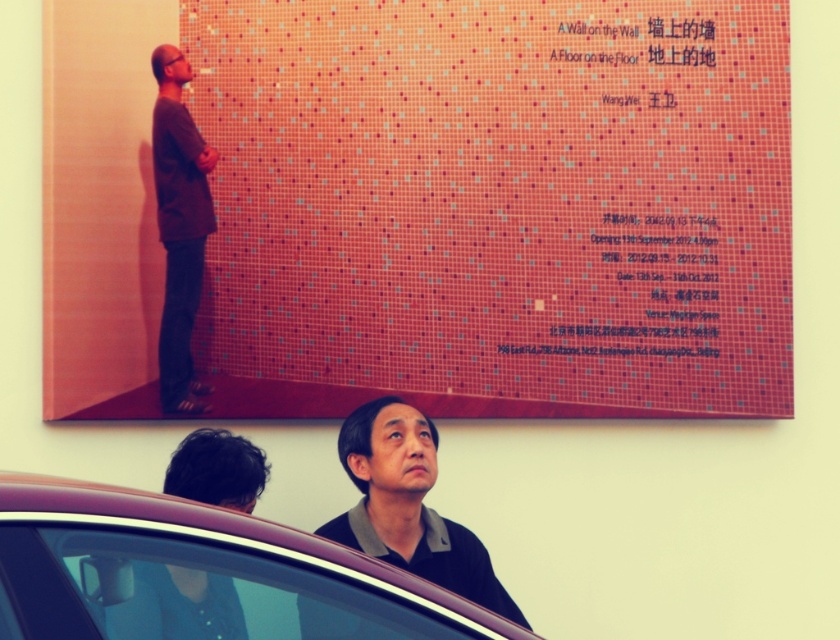
Based on the photo, is brown matte sweater at upper left closer to the viewer compared to dark brown hair at upper center?

No, brown matte sweater at upper left is behind dark brown hair at upper center.

Can you confirm if brown matte sweater at upper left is positioned below dark brown hair at upper center?

Actually, brown matte sweater at upper left is above dark brown hair at upper center.

This screenshot has width=840, height=640. In order to click on brown matte sweater at upper left in this screenshot , I will do `click(179, 227)`.

The width and height of the screenshot is (840, 640). Identify the location of brown matte sweater at upper left. (179, 227).

From the picture: Can you confirm if metallic car at lower center is positioned to the left of black matte shirt at center?

Indeed, metallic car at lower center is positioned on the left side of black matte shirt at center.

The height and width of the screenshot is (640, 840). I want to click on metallic car at lower center, so (201, 572).

Find the location of a particular element. This screenshot has width=840, height=640. metallic car at lower center is located at coordinates (201, 572).

Is point (357, 586) positioned after point (172, 81)?

No, it is not.

Does point (71, 573) come in front of point (155, 51)?

Yes, point (71, 573) is in front of point (155, 51).

Locate an element on the screen. This screenshot has height=640, width=840. metallic car at lower center is located at coordinates (201, 572).